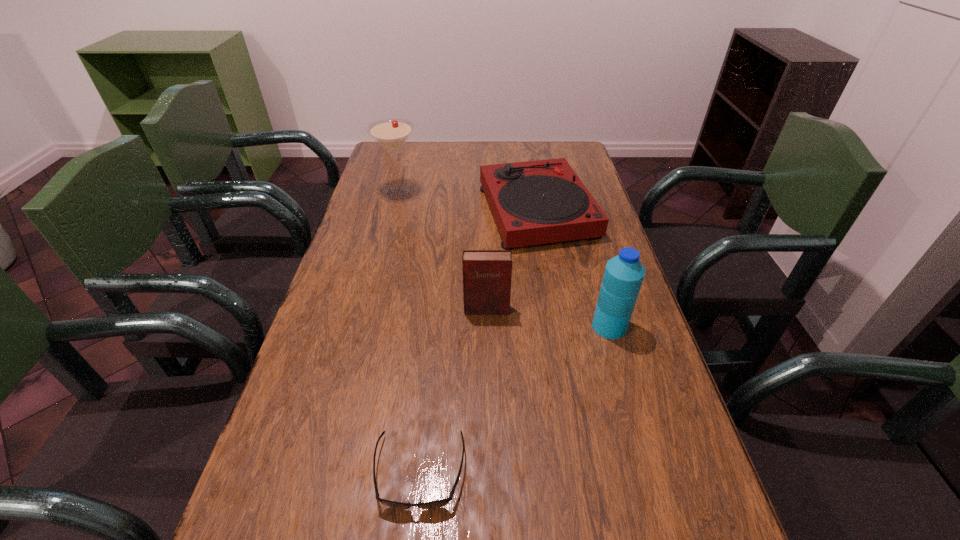
You are a GUI agent. You are given a task and a screenshot of the screen. Output one action in this format:
    pyautogui.click(x=<x>, y=<y>)
    Task: Click on the leftmost object
    
    Given the screenshot: What is the action you would take?
    pyautogui.click(x=391, y=134)

Where is `water bottle`? Image resolution: width=960 pixels, height=540 pixels. water bottle is located at coordinates (624, 273).

Locate an element on the screen. This screenshot has height=540, width=960. the third tallest object is located at coordinates (487, 274).

The width and height of the screenshot is (960, 540). What are the coordinates of `the second shortest object` in the screenshot? It's located at (536, 202).

The width and height of the screenshot is (960, 540). I want to click on sunglasses, so click(x=438, y=503).

Find the location of a particular element. The width and height of the screenshot is (960, 540). the shortest object is located at coordinates (438, 503).

At what (x,y) coordinates should I click in order to perform the action: click on free point located on the right of the martini. Please return your answer as a coordinate pair (x, y). This screenshot has width=960, height=540. Looking at the image, I should click on (445, 192).

This screenshot has height=540, width=960. In order to click on free space located 0.220m on the left of the water bottle in this screenshot , I will do point(498,326).

At what (x,y) coordinates should I click in order to perform the action: click on vacant area situated on the front cover of the third shortest object. Please return your answer as a coordinate pair (x, y). Looking at the image, I should click on (488, 399).

You are a GUI agent. You are given a task and a screenshot of the screen. Output one action in this format:
    pyautogui.click(x=<x>, y=<y>)
    Task: Click on the vacant space positioned 0.200m on the back of the fourth tallest object
    
    Given the screenshot: What is the action you would take?
    pyautogui.click(x=527, y=151)